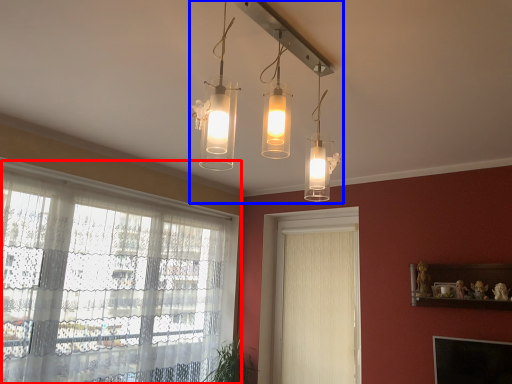
Question: Which object appears farthest to the camera in this image, window (highlighted by a red box) or light fixture (highlighted by a blue box)?

Choices:
 (A) window
 (B) light fixture

Answer: (A)